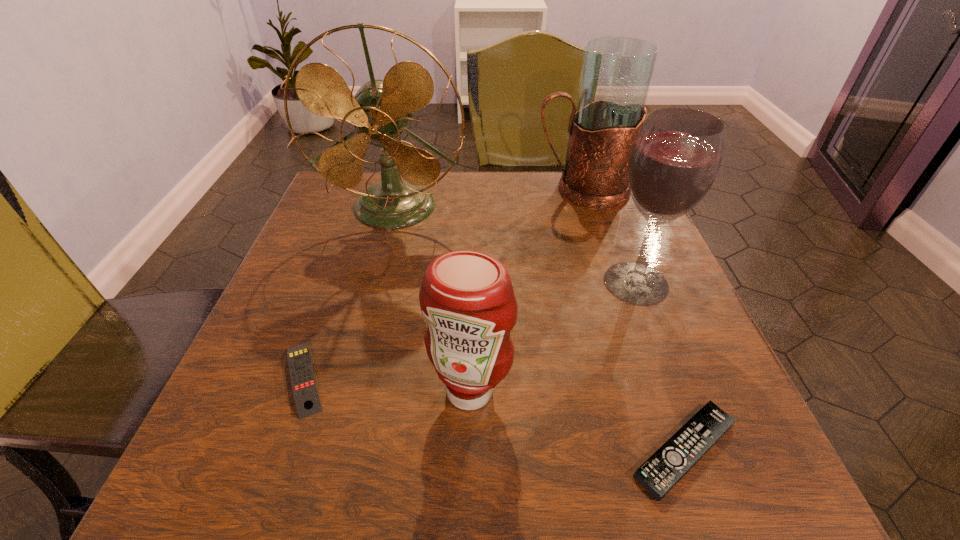
At what (x,y) coordinates should I click in order to perform the action: click on free location located 0.240m with the handle on the side of the pitcher. Please return your answer as a coordinate pair (x, y). Looking at the image, I should click on (441, 191).

At what (x,y) coordinates should I click in order to perform the action: click on vacant region located with the handle on the side of the pitcher. Please return your answer as a coordinate pair (x, y). This screenshot has height=540, width=960. Looking at the image, I should click on (452, 191).

Where is `vacant space located on the left of the fourth nearest object`? The height and width of the screenshot is (540, 960). vacant space located on the left of the fourth nearest object is located at coordinates (491, 283).

This screenshot has height=540, width=960. Identify the location of vacant space located on the back of the condiment. (472, 291).

Where is `vacant area situated 0.320m on the right of the fifth tallest object`? The width and height of the screenshot is (960, 540). vacant area situated 0.320m on the right of the fifth tallest object is located at coordinates (533, 377).

Where is `vacant area situated 0.140m on the back of the right remote control`? vacant area situated 0.140m on the back of the right remote control is located at coordinates (644, 335).

The height and width of the screenshot is (540, 960). What are the coordinates of `fan at the far edge` in the screenshot? It's located at (380, 110).

The height and width of the screenshot is (540, 960). I want to click on pitcher at the far edge, so click(616, 74).

Where is `object that is at the near edge`? object that is at the near edge is located at coordinates (661, 472).

The width and height of the screenshot is (960, 540). Identify the location of fan located at the left edge. (380, 110).